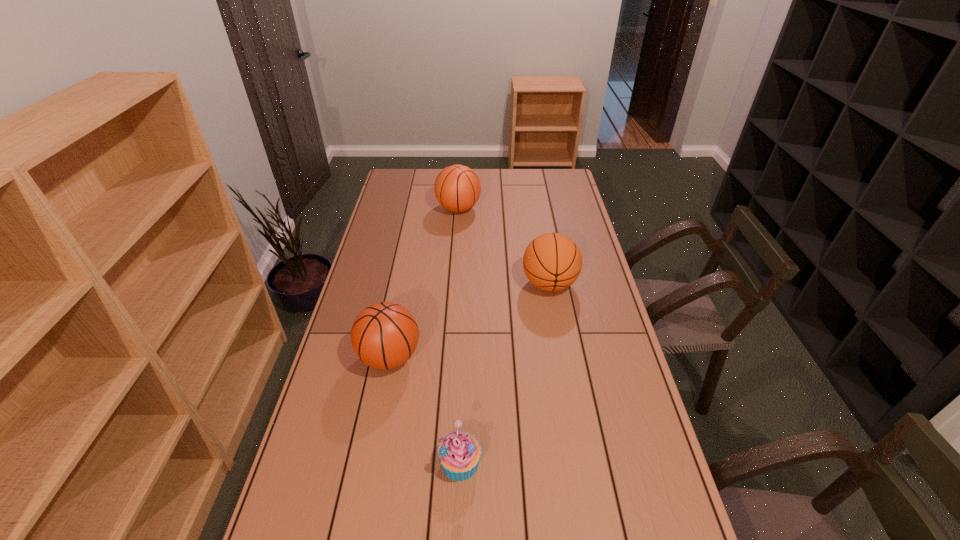
Find the location of a particular element. basketball that is the second closest to the second nearest basketball is located at coordinates (384, 335).

Find the location of `blank area in the image that satisfies the following two spatial constraints: 1. on the back side of the nearest basketball; 2. on the right side of the farthest basketball`. blank area in the image that satisfies the following two spatial constraints: 1. on the back side of the nearest basketball; 2. on the right side of the farthest basketball is located at coordinates (419, 208).

The width and height of the screenshot is (960, 540). In order to click on free point that satisfies the following two spatial constraints: 1. on the back side of the second nearest object; 2. on the right side of the rightmost basketball in this screenshot , I will do `click(404, 284)`.